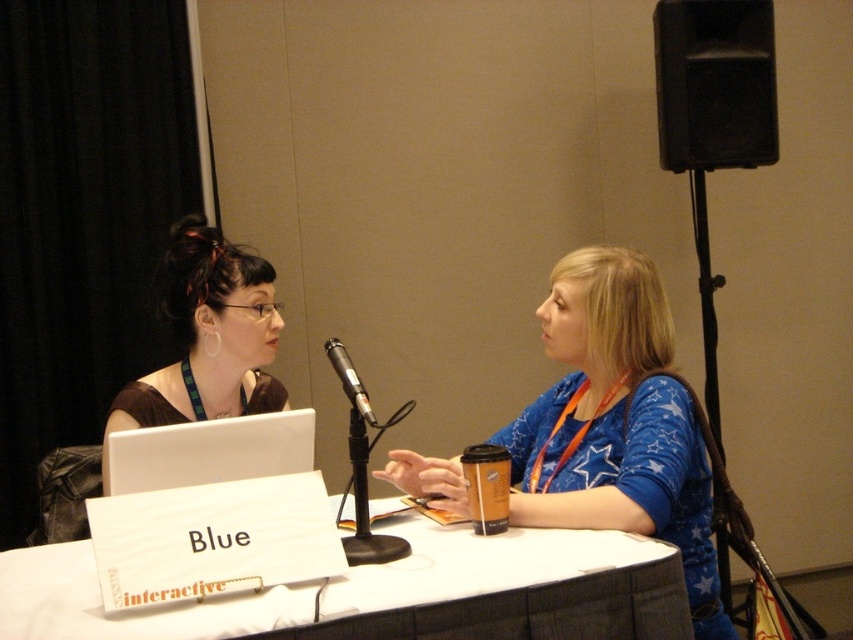
Question: Where is blue fabric shirt at center located in relation to black metallic microphone at center in the image?

Choices:
 (A) below
 (B) above

Answer: (A)

Question: Which point appears closest to the camera in this image?

Choices:
 (A) (598, 464)
 (B) (666, 116)
 (C) (509, 589)
 (D) (254, 436)

Answer: (C)

Question: Is white paperboard at center to the right of white plastic laptop at center from the viewer's perspective?

Choices:
 (A) no
 (B) yes

Answer: (B)

Question: Which point is farther to the camera?

Choices:
 (A) matte brown shirt at center
 (B) white paperboard at center
 (C) blue fabric shirt at center
 (D) black metallic microphone at center

Answer: (A)

Question: Which point is closer to the camera?

Choices:
 (A) (613, 369)
 (B) (202, 273)

Answer: (A)

Question: Is blue fabric shirt at center to the left of black metallic microphone at center from the viewer's perspective?

Choices:
 (A) yes
 (B) no

Answer: (B)